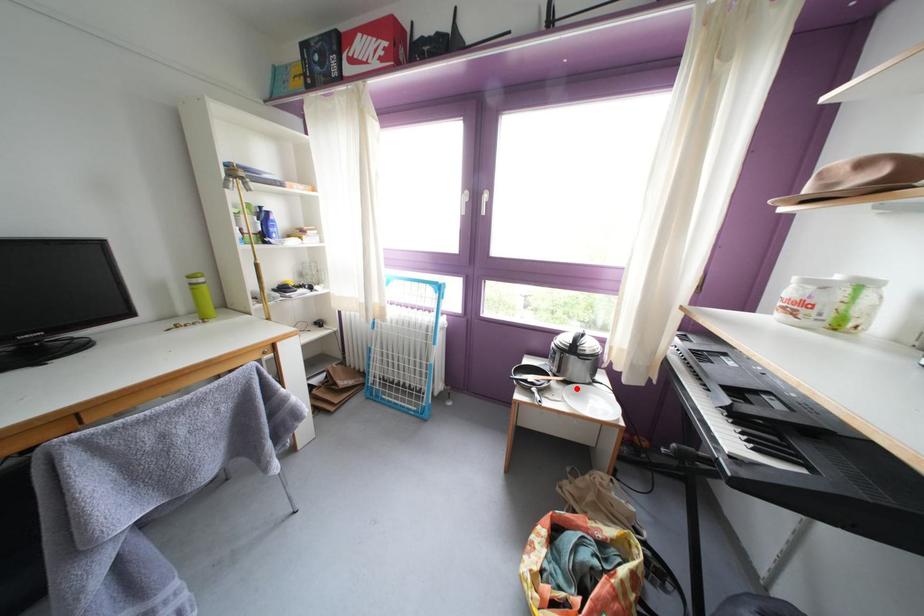
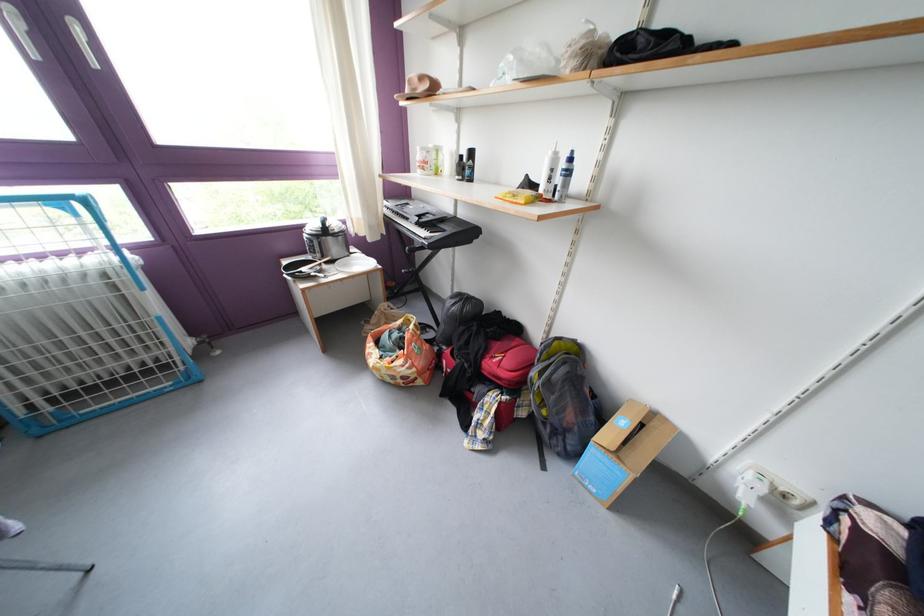
Question: I am providing you with two images of the same scene from different viewpoints. Given a red point in image1, look at the same physical point in image2. Is it:

Choices:
 (A) Closer to the viewpoint
 (B) Farther from the viewpoint

Answer: (A)